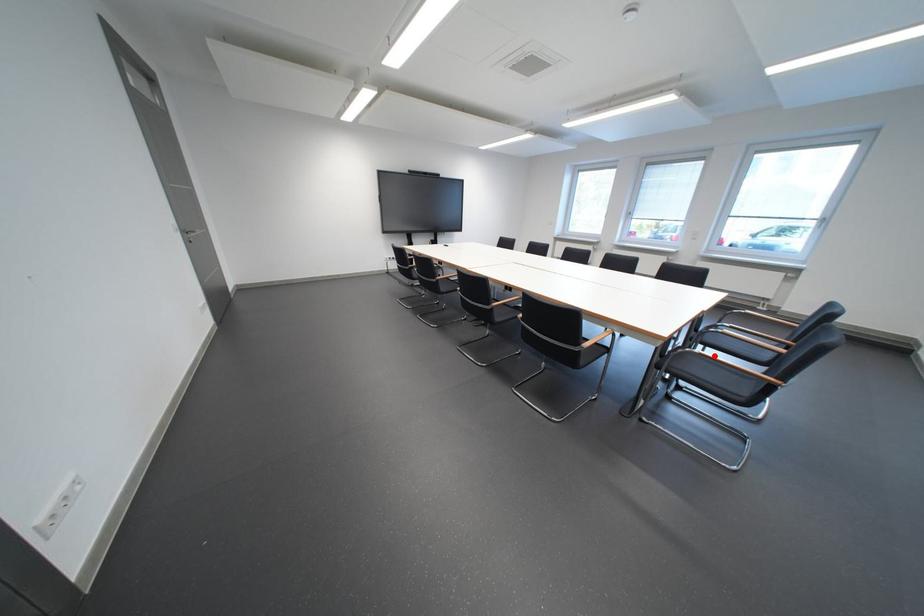
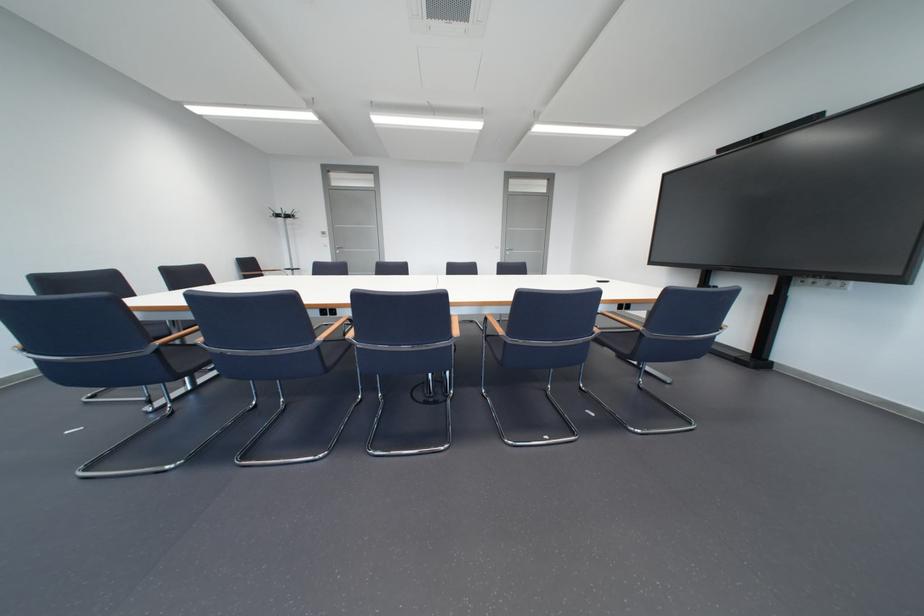
Question: I am providing you with two images of the same scene from different viewpoints. A red point is marked on the first image. Is the red point's position out of view in image 2?

Choices:
 (A) Yes
 (B) No

Answer: (A)